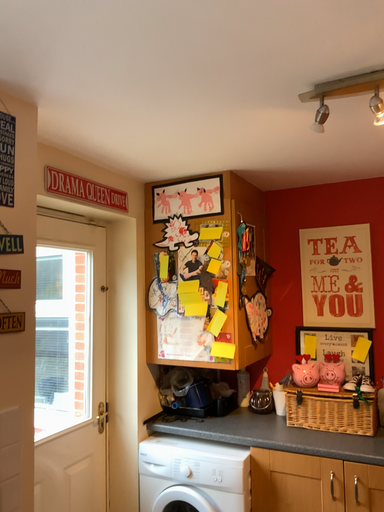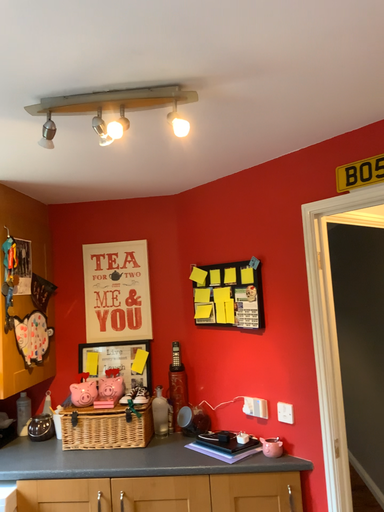
Question: How did the camera likely rotate when shooting the video?

Choices:
 (A) rotated left
 (B) rotated right

Answer: (B)